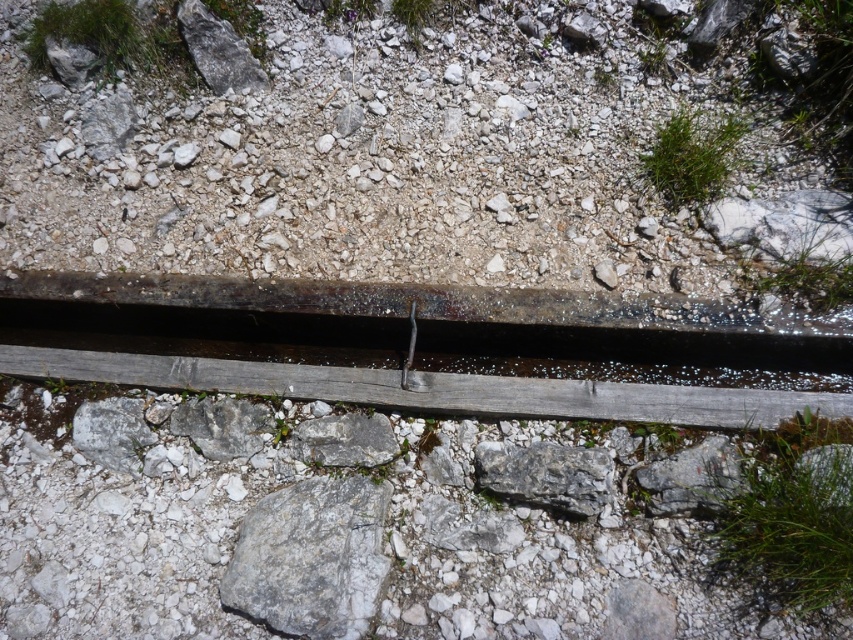
You are a small toy car that is 10 cm long. You want to drive from the gray rough stone at center to the gray rough rock at lower right. Can you fit through the space between them?

The gray rough stone at center is larger in size than the gray rough rock at lower right, but the exact distance between them isn not specified. Without knowing the space between them, it is impossible to determine if the toy car can fit through.

You are a gardener trying to place a small potted plant between the gray rough rock at center and the gray rough stone at center. Can you fit it there?

The gray rough rock at center is bigger than the gray rough stone at center, so there might be enough space between them to fit the small potted plant.

You are a farmer walking along the rusty metal rail at center and the gray rough rock at lower right. Which object is closer to your left side?

The rusty metal rail at center is to the left of the gray rough rock at lower right, so it is closer to your left side.